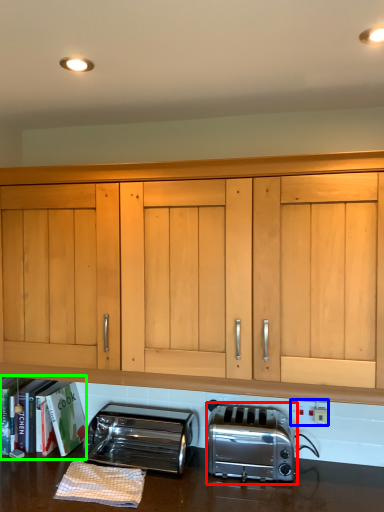
Question: Which is nearer to the toaster (highlighted by a red box)? electric outlet (highlighted by a blue box) or bookshelf (highlighted by a green box).

Choices:
 (A) electric outlet
 (B) bookshelf

Answer: (A)